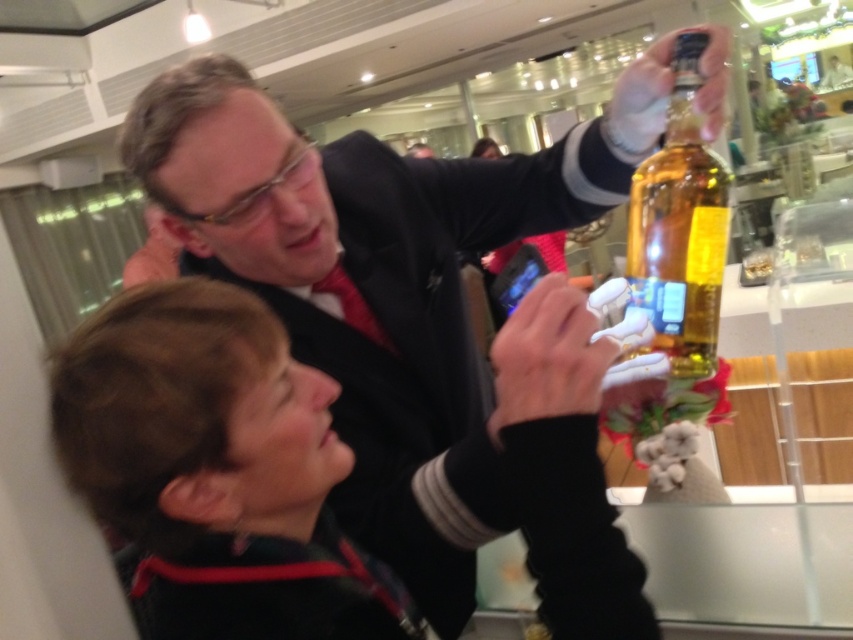
Does black fabric jacket at center have a smaller size compared to translucent glass bottle at upper right?

No, black fabric jacket at center is not smaller than translucent glass bottle at upper right.

Which is behind, point (134, 401) or point (706, 163)?

Point (706, 163)

From the picture: Who is more forward, (134, 387) or (706, 262)?

Point (134, 387)

The height and width of the screenshot is (640, 853). What are the coordinates of `black fabric jacket at center` in the screenshot? It's located at (216, 472).

Is matte black jacket at upper center shorter than translucent glass bottle at upper right?

In fact, matte black jacket at upper center may be taller than translucent glass bottle at upper right.

From the picture: Can you confirm if matte black jacket at upper center is positioned below translucent glass bottle at upper right?

Correct, matte black jacket at upper center is located below translucent glass bottle at upper right.

Locate an element on the screen. This screenshot has width=853, height=640. matte black jacket at upper center is located at coordinates (422, 323).

Locate an element on the screen. This screenshot has height=640, width=853. matte black jacket at upper center is located at coordinates (422, 323).

Who is shorter, matte black jacket at upper center or black fabric jacket at center?

Standing shorter between the two is black fabric jacket at center.

Is point (431, 426) farther from camera compared to point (178, 625)?

Yes, it is behind point (178, 625).

The image size is (853, 640). I want to click on matte black jacket at upper center, so click(422, 323).